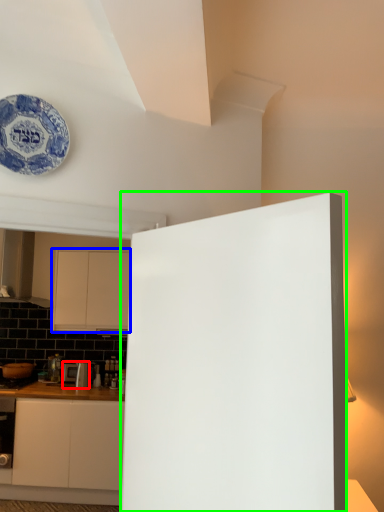
Question: Based on their relative distances, which object is nearer to appliance (highlighted by a red box)? Choose from cabinetry (highlighted by a blue box) and door (highlighted by a green box).

Choices:
 (A) cabinetry
 (B) door

Answer: (A)